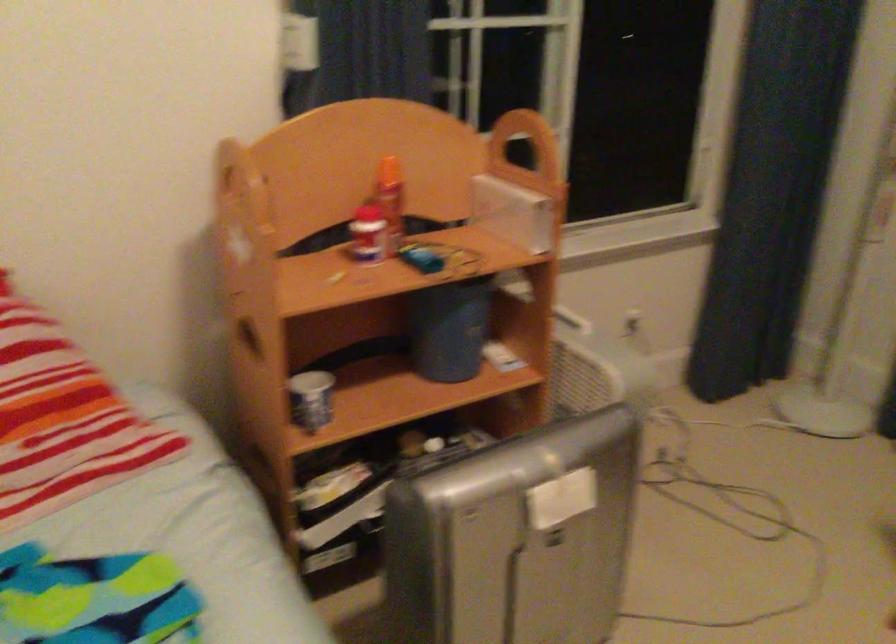
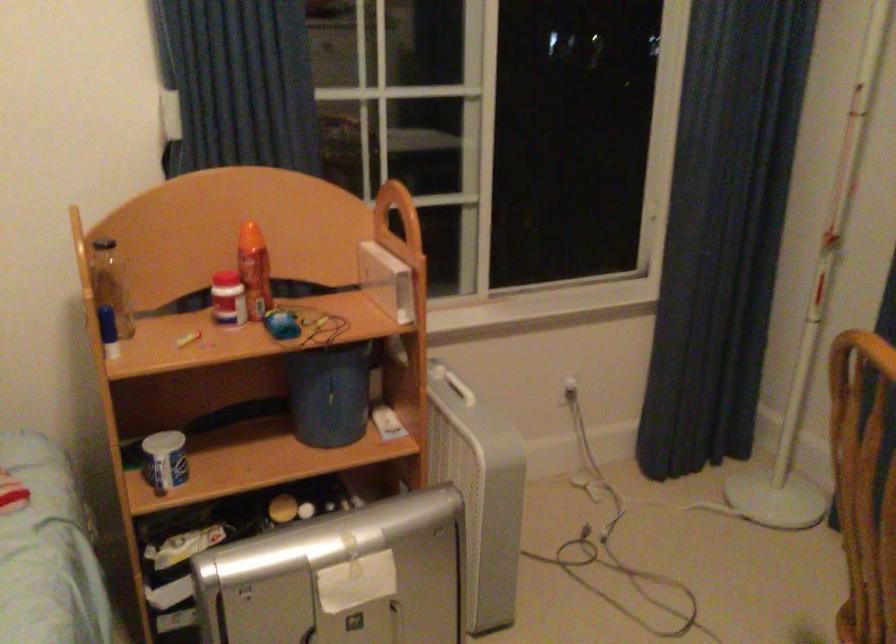
Find the pixel in the second image that matches point (421, 257) in the first image.

(281, 324)